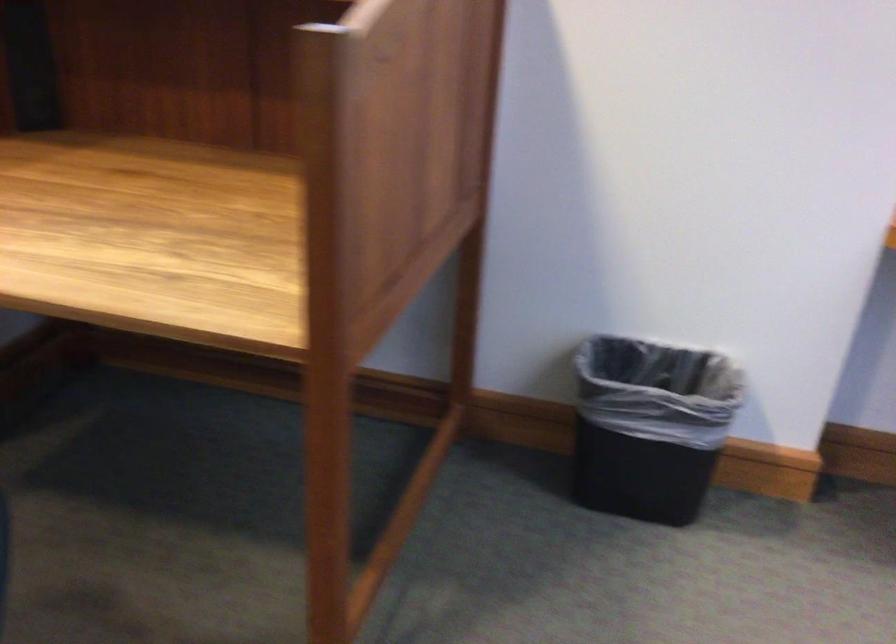
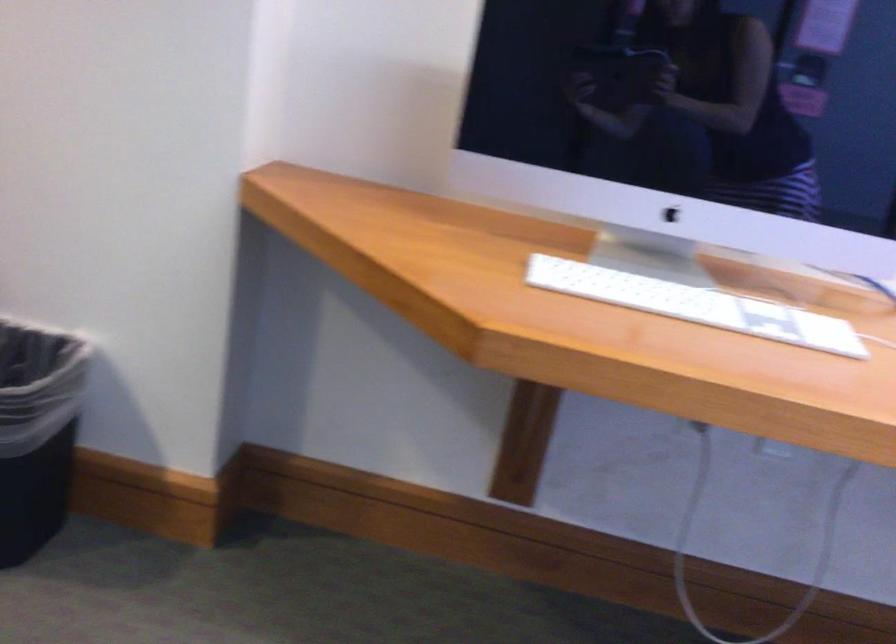
In the second image, find the point that corresponds to point 745,426 in the first image.

(37, 431)